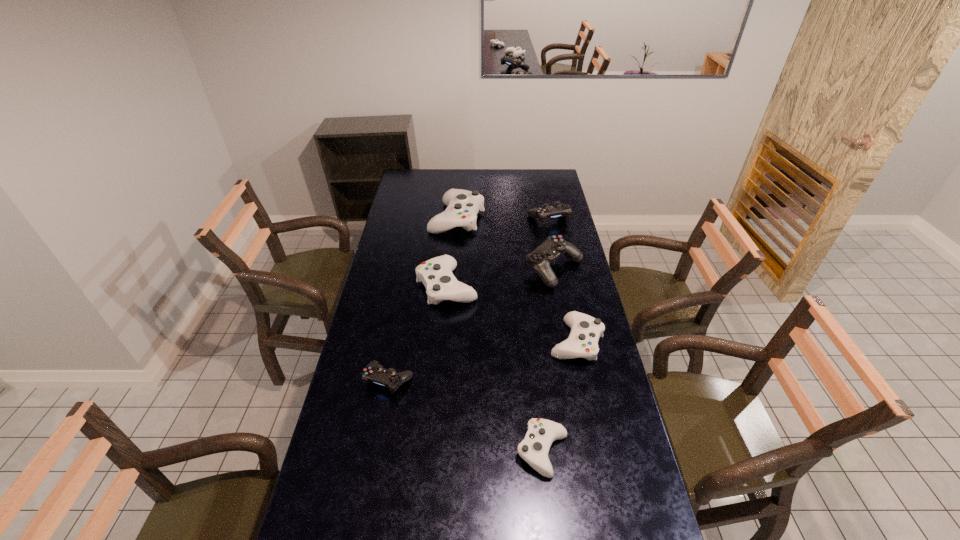
This screenshot has width=960, height=540. I want to click on vacant area located 0.120m on the back of the biggest black control, so click(547, 235).

Where is `vacant area situated 0.110m on the back of the third smallest white control`? The width and height of the screenshot is (960, 540). vacant area situated 0.110m on the back of the third smallest white control is located at coordinates (450, 250).

Image resolution: width=960 pixels, height=540 pixels. What are the coordinates of `free space located on the left of the farthest black control` in the screenshot? It's located at (474, 218).

Identify the location of free space located 0.240m on the front of the third farthest white control. (594, 428).

Identify the location of blank space located 0.220m on the back of the smallest black control. Image resolution: width=960 pixels, height=540 pixels. (400, 319).

The height and width of the screenshot is (540, 960). In order to click on vacant region located 0.150m on the front of the nearest white control in this screenshot , I will do `click(552, 538)`.

Where is `object present at the left edge`? This screenshot has width=960, height=540. object present at the left edge is located at coordinates (374, 372).

The height and width of the screenshot is (540, 960). I want to click on free space at the left edge of the desktop, so click(405, 310).

The image size is (960, 540). Identify the location of vacant space at the right edge of the desktop. tap(557, 278).

This screenshot has height=540, width=960. I want to click on free space between the third smallest white control and the farthest white control, so click(452, 253).